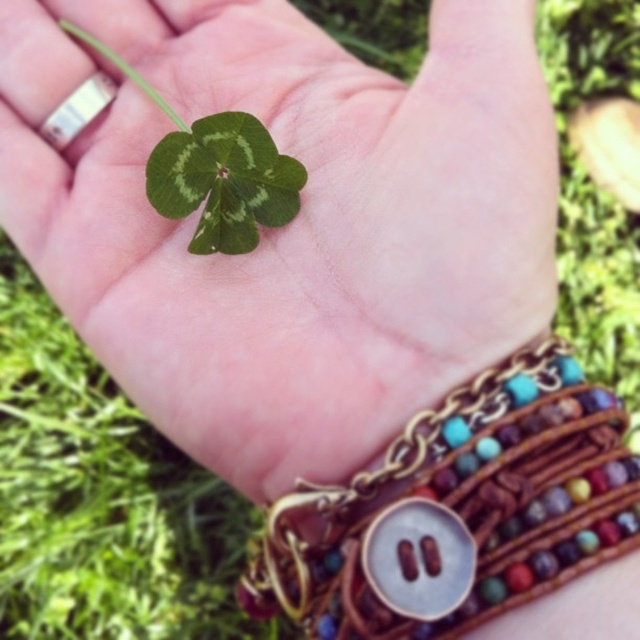
Question: Among these objects, which one is nearest to the camera?

Choices:
 (A) green matte clover at center
 (B) brown leather bracelet with beads at center

Answer: (B)

Question: Is brown leather bracelet with beads at center wider than green matte clover at center?

Choices:
 (A) no
 (B) yes

Answer: (B)

Question: Can you confirm if brown leather bracelet with beads at center is bigger than green matte clover at center?

Choices:
 (A) no
 (B) yes

Answer: (B)

Question: Is brown leather bracelet with beads at center below green matte clover at center?

Choices:
 (A) yes
 (B) no

Answer: (A)

Question: Which point is closer to the camera?

Choices:
 (A) green matte leaf at center
 (B) green matte clover at center

Answer: (A)

Question: Which object is farther from the camera taking this photo?

Choices:
 (A) brown leather bracelet with beads at center
 (B) green matte clover at center
 (C) green matte leaf at center

Answer: (B)